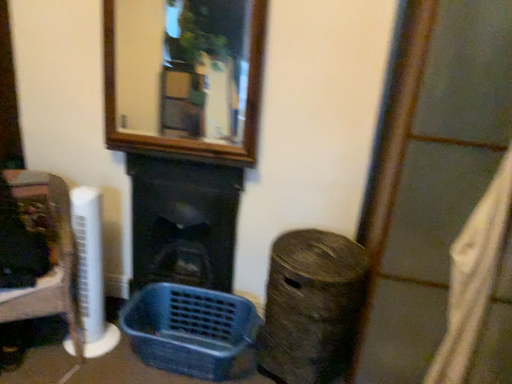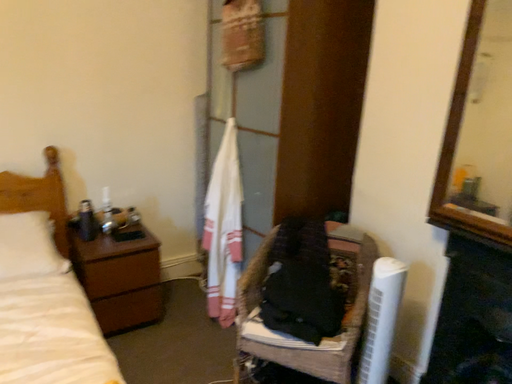
Question: Which way did the camera rotate in the video?

Choices:
 (A) rotated downward
 (B) rotated upward

Answer: (B)